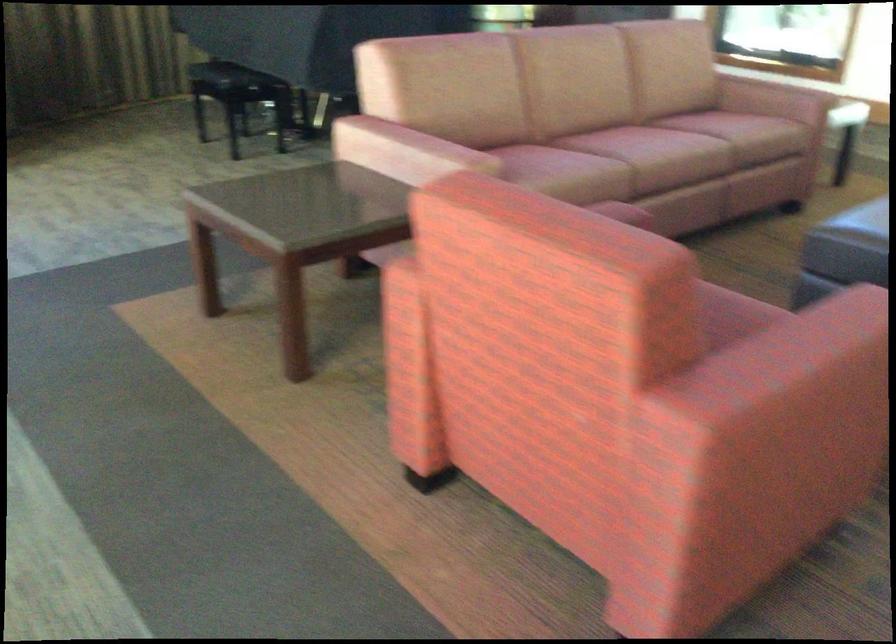
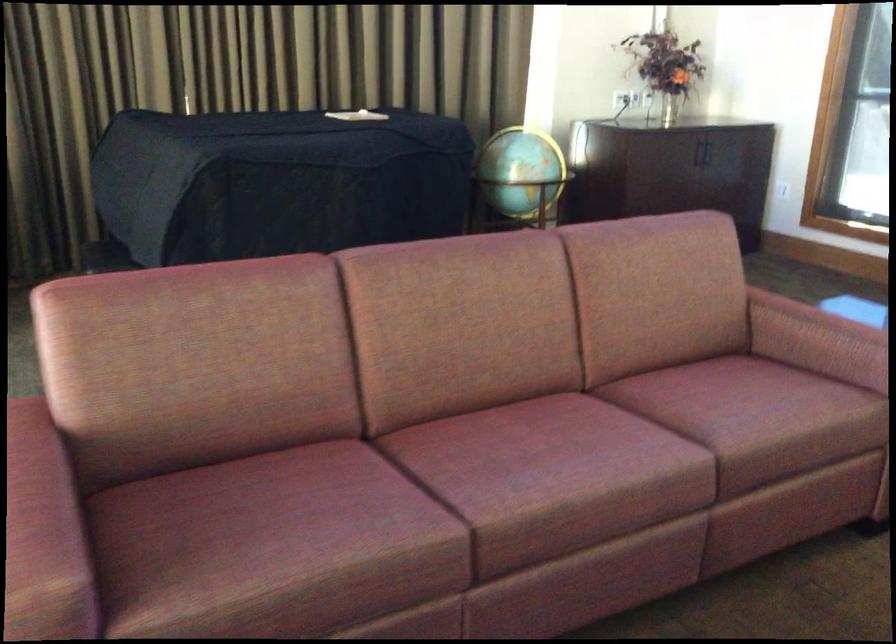
In a continuous first-person perspective shot, in which direction is the camera moving?

The movement direction of the cameraman is right, forward.